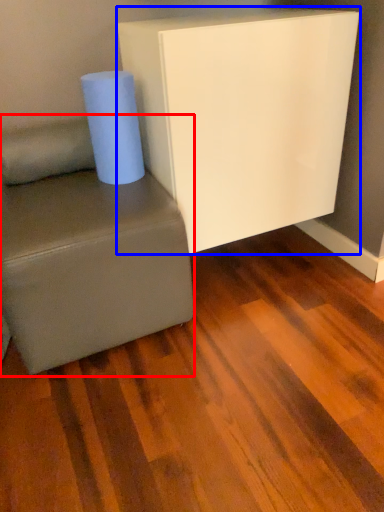
Question: Which object is further to the camera taking this photo, studio couch (highlighted by a red box) or furniture (highlighted by a blue box)?

Choices:
 (A) studio couch
 (B) furniture

Answer: (B)